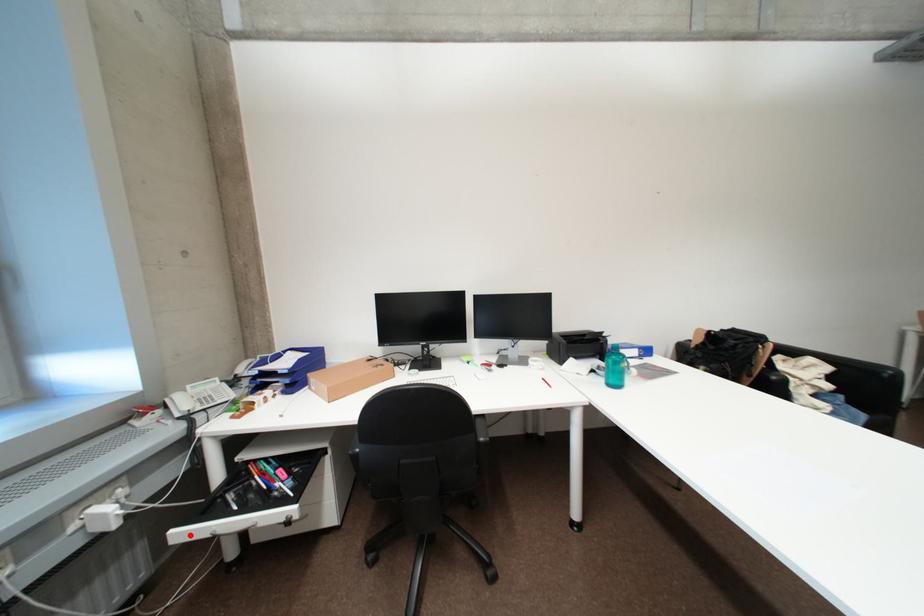
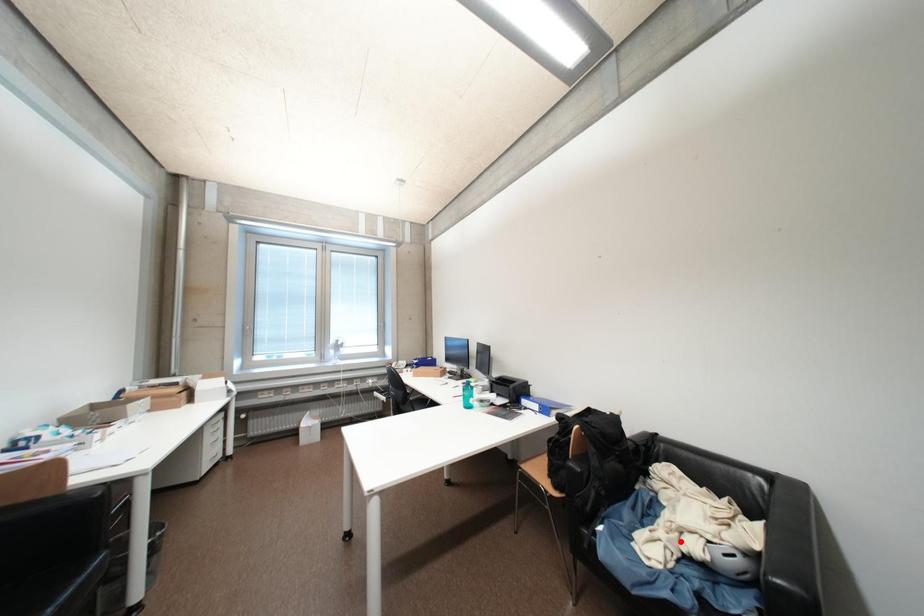
I am providing you with two images of the same scene from different viewpoints. A red point is marked on the first image and another point is marked on the second image. Does the point marked in image1 correspond to the same location as the one in image2?

No